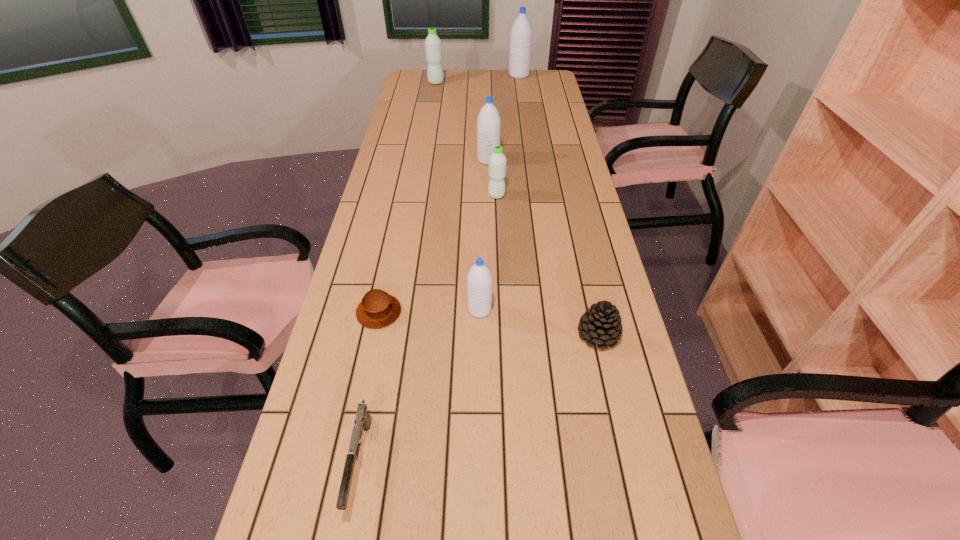
Locate an element on the screen. This screenshot has height=540, width=960. the farthest blue water bottle is located at coordinates (521, 32).

The width and height of the screenshot is (960, 540). Find the location of `the rightmost blue water bottle`. the rightmost blue water bottle is located at coordinates (521, 32).

Find the location of a particular element. The height and width of the screenshot is (540, 960). the leftmost water bottle is located at coordinates (433, 48).

Find the location of a particular element. The image size is (960, 540). the bigger green water bottle is located at coordinates (433, 48).

Where is `the third farthest object`? the third farthest object is located at coordinates pyautogui.click(x=488, y=123).

This screenshot has height=540, width=960. I want to click on the second smallest blue water bottle, so click(x=488, y=123).

At what (x,y) coordinates should I click in order to perform the action: click on the fourth farthest object. Please return your answer as a coordinate pair (x, y). Looking at the image, I should click on (497, 161).

Locate an element on the screen. the second nearest water bottle is located at coordinates (497, 161).

The width and height of the screenshot is (960, 540). What are the coordinates of `the nearest water bottle` in the screenshot? It's located at (479, 278).

Image resolution: width=960 pixels, height=540 pixels. Find the location of `the smallest blue water bottle`. the smallest blue water bottle is located at coordinates (479, 278).